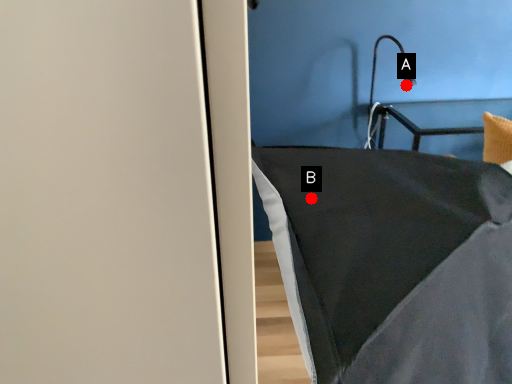
Question: Two points are circled on the image, labeled by A and B beside each circle. Which point is farther from the camera taking this photo?

Choices:
 (A) A is further
 (B) B is further

Answer: (A)